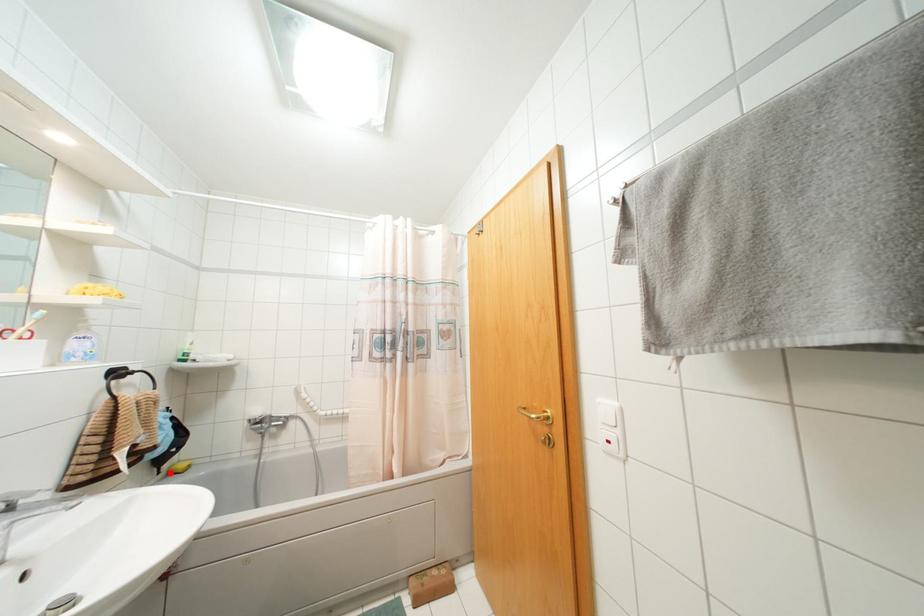
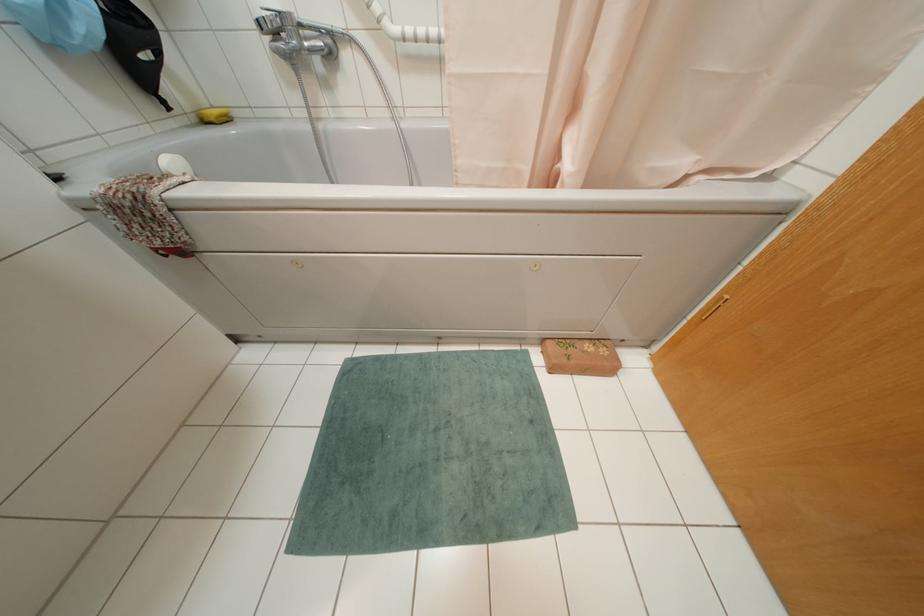
Find the pixel in the second image that matches the highlighted location in the first image.

(202, 121)